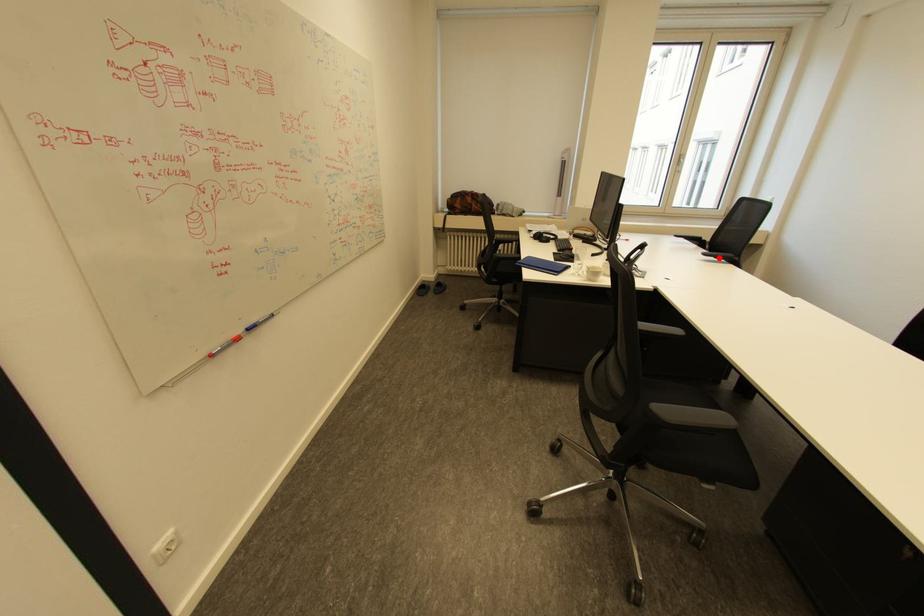
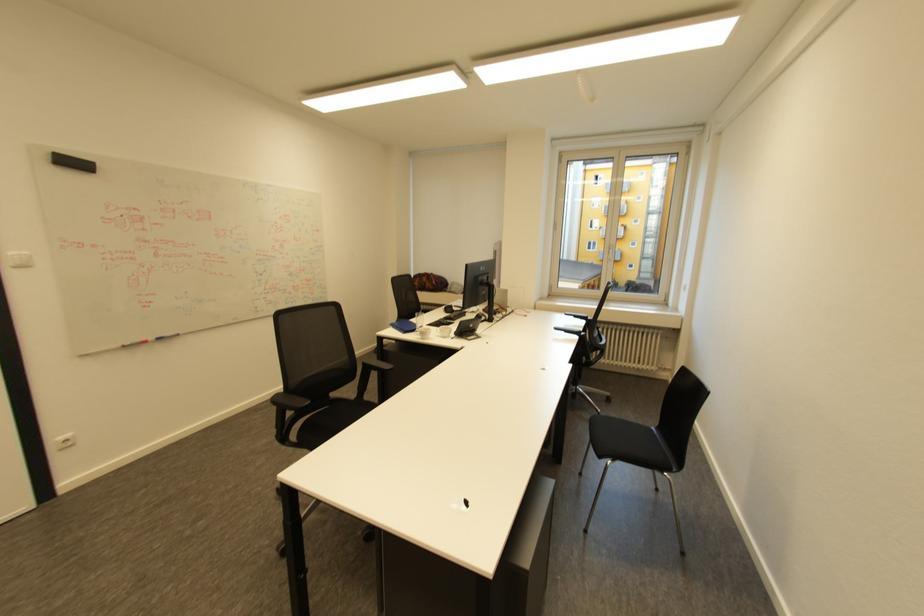
In the second image, find the point that corresponds to the highlighted location in the first image.

(570, 333)